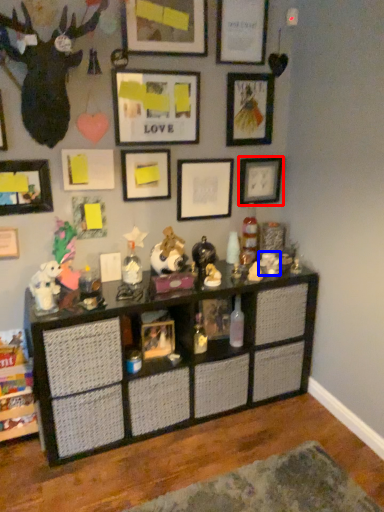
Question: Which point is closer to the camera, picture frame (highlighted by a red box) or toy (highlighted by a blue box)?

Choices:
 (A) picture frame
 (B) toy

Answer: (A)